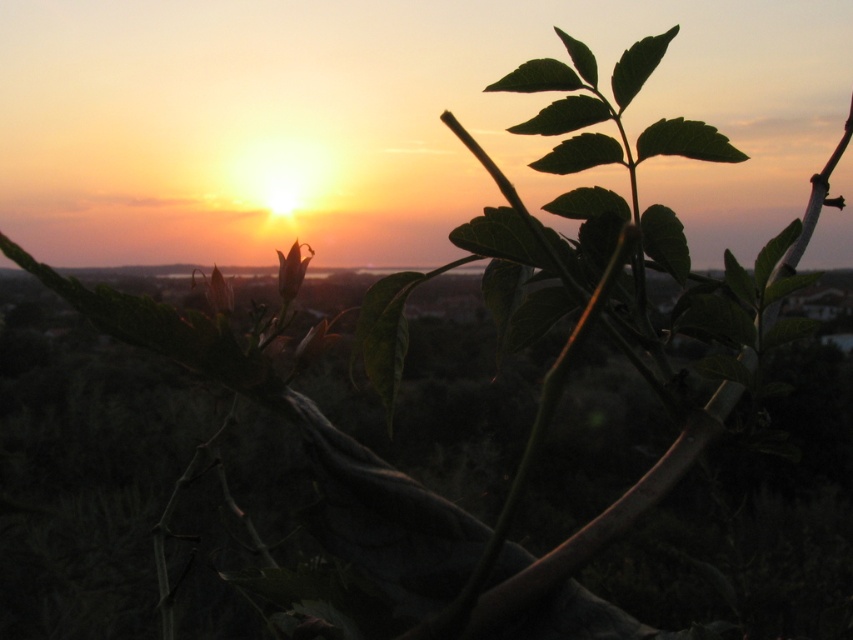
Question: Can you confirm if translucent orange flower at center is positioned to the left of green matte flower at center?

Choices:
 (A) no
 (B) yes

Answer: (A)

Question: Does translucent orange flower at center appear under green matte flower at center?

Choices:
 (A) no
 (B) yes

Answer: (A)

Question: Can you confirm if translucent orange flower at center is positioned below green matte flower at center?

Choices:
 (A) yes
 (B) no

Answer: (B)

Question: Which point is closer to the camera?

Choices:
 (A) green matte flower at center
 (B) translucent orange flower at center

Answer: (B)